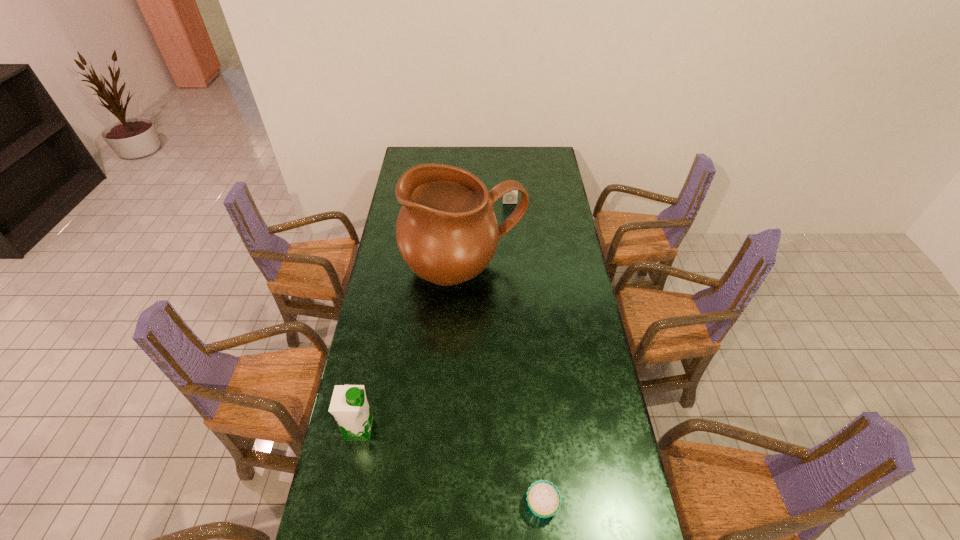
The width and height of the screenshot is (960, 540). In order to click on the tallest object in this screenshot , I will do `click(447, 233)`.

Locate an element on the screen. This screenshot has width=960, height=540. the second farthest object is located at coordinates (447, 233).

The height and width of the screenshot is (540, 960). In order to click on soya milk in this screenshot , I will do `click(349, 406)`.

The width and height of the screenshot is (960, 540). In order to click on the second nearest object in this screenshot , I will do `click(349, 406)`.

You are a GUI agent. You are given a task and a screenshot of the screen. Output one action in this format:
    pyautogui.click(x=<x>, y=<y>)
    Task: Click on the iPod
    The image size is (960, 540).
    Given the screenshot: What is the action you would take?
    511,197

What are the coordinates of `cupcake` in the screenshot? It's located at (544, 499).

Locate an element on the screen. The height and width of the screenshot is (540, 960). the shortest object is located at coordinates (544, 499).

At what (x,y) coordinates should I click in order to perform the action: click on vacant region located 0.150m at the spout of the second farthest object. Please return your answer as a coordinate pair (x, y). This screenshot has height=540, width=960. Looking at the image, I should click on (462, 335).

This screenshot has width=960, height=540. What are the coordinates of `vacant point located 0.310m on the front-facing side of the third farthest object` in the screenshot? It's located at (473, 429).

Where is `free region located on the front-facing side of the farthest object`? The image size is (960, 540). free region located on the front-facing side of the farthest object is located at coordinates (512, 232).